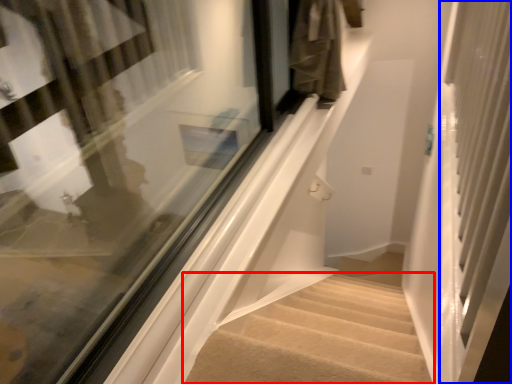
Question: Which object appears closest to the camera in this image, stairs (highlighted by a red box) or screen door (highlighted by a blue box)?

Choices:
 (A) stairs
 (B) screen door

Answer: (B)